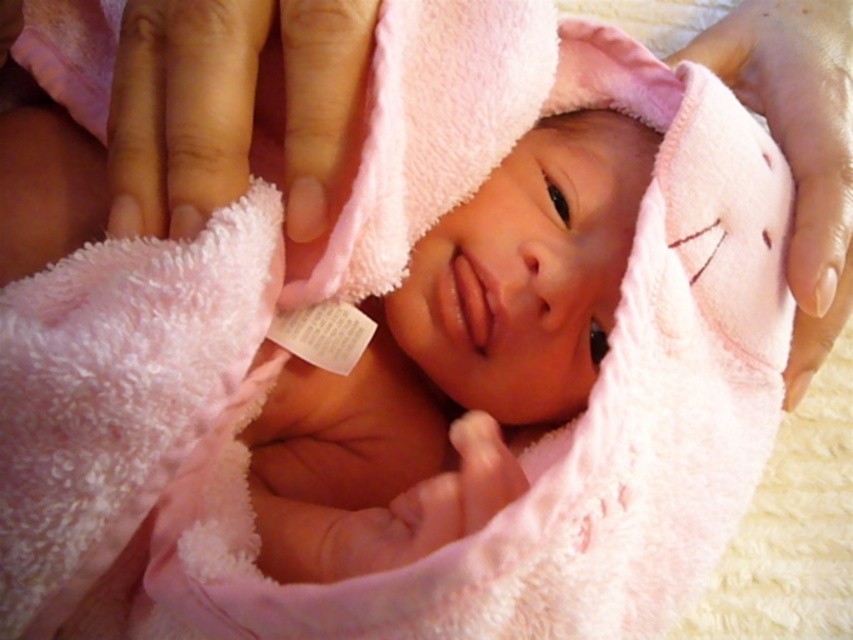
Does smooth pink towel at upper left have a smaller size compared to pink soft towel at upper center?

Yes, smooth pink towel at upper left is smaller than pink soft towel at upper center.

Can you confirm if smooth pink towel at upper left is bigger than pink soft towel at upper center?

Actually, smooth pink towel at upper left might be smaller than pink soft towel at upper center.

Does point (137, 205) come in front of point (840, 248)?

Yes, point (137, 205) is in front of point (840, 248).

Where is `smooth pink towel at upper left`? The image size is (853, 640). smooth pink towel at upper left is located at coordinates (229, 108).